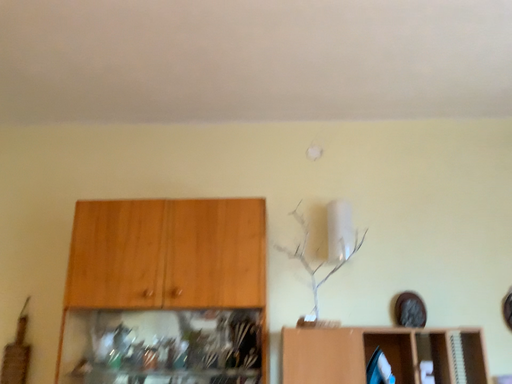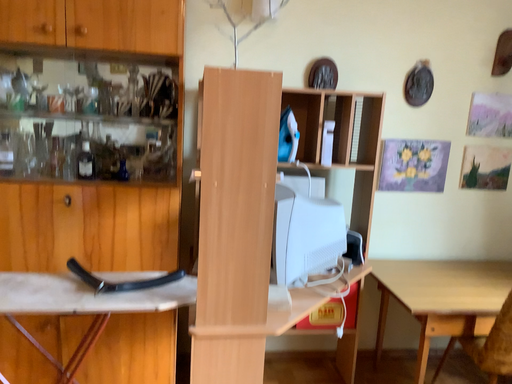
Question: Which way did the camera rotate in the video?

Choices:
 (A) rotated upward
 (B) rotated downward

Answer: (B)